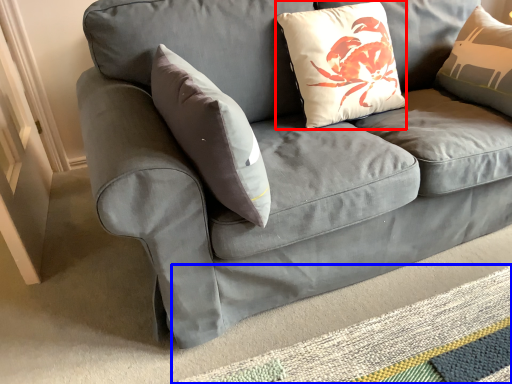
Question: Which object appears farthest to the camera in this image, pillow (highlighted by a red box) or mat (highlighted by a blue box)?

Choices:
 (A) pillow
 (B) mat

Answer: (A)